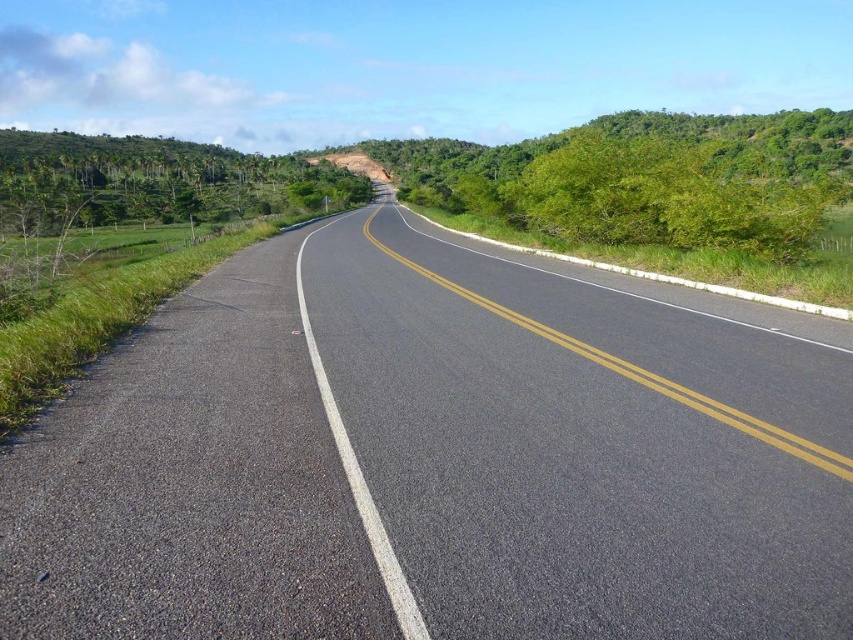
You are driving a car and need to stay within the road. Based on the scene, which object takes up more space in the image, the asphalt road at center or the green leafy trees at left?

The green leafy trees at left take up more space in the image than the asphalt road at center.

You are a driver approaching the asphalt road at center and notice green leafy trees at left. Which object is taller from your perspective?

The green leafy trees at left are taller than the asphalt road at center.